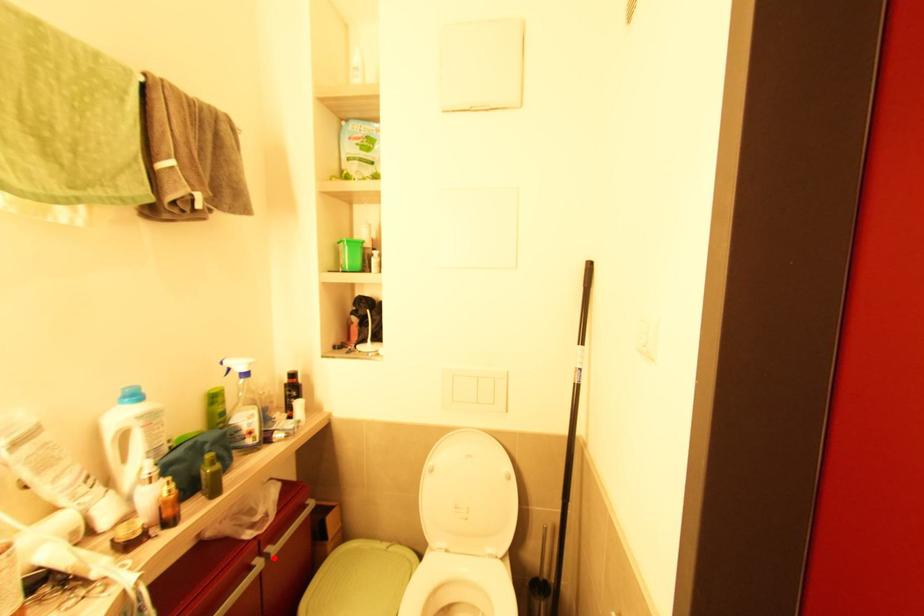
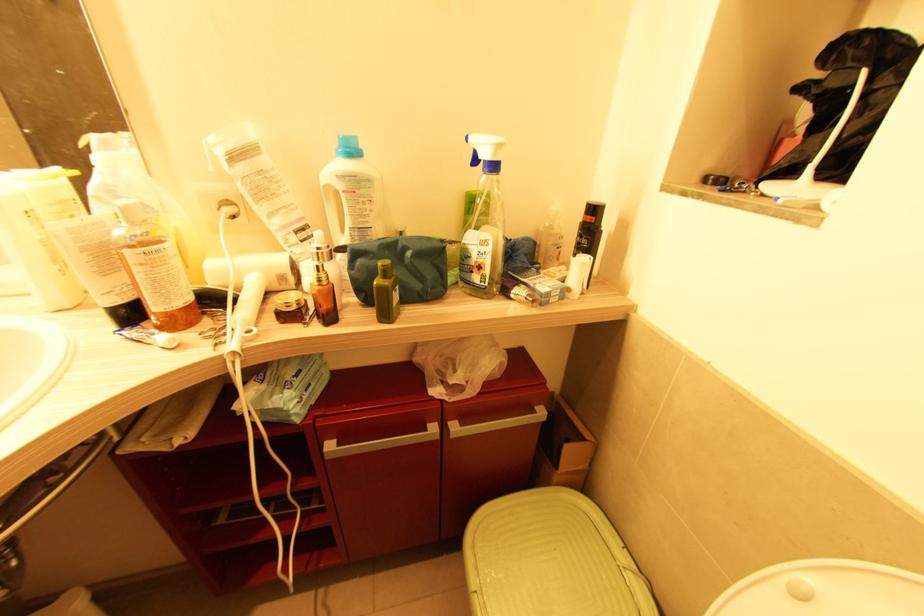
Where in the second image is the point corresponding to the highlighted location from the first image?

(454, 438)